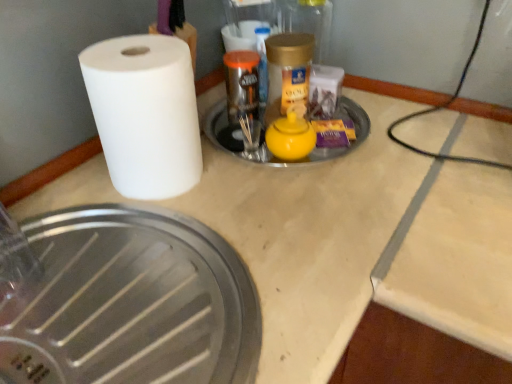
Question: Relative to yellow matte teapot at center, the first manhole cover from the top, is brushed metal manhole cover at lower left, which is counted as the 1th manhole cover, starting from the bottom, in front or behind?

Choices:
 (A) front
 (B) behind

Answer: (A)

Question: Looking at their shapes, would you say brushed metal manhole cover at lower left, the 2th manhole cover viewed from the top, is wider or thinner than yellow matte teapot at center, which appears as the 2th manhole cover when ordered from the bottom?

Choices:
 (A) thin
 (B) wide

Answer: (B)

Question: Estimate the real-world distances between objects in this image. Which object is closer to the yellow matte teapot at center, the first manhole cover from the top?

Choices:
 (A) gold metallic jar at upper center
 (B) brushed metal manhole cover at lower left, which is counted as the 1th manhole cover, starting from the bottom
 (C) white matte paper towel at left

Answer: (C)

Question: Considering the real-world distances, which object is closest to the brushed metal manhole cover at lower left, which is counted as the 1th manhole cover, starting from the bottom?

Choices:
 (A) white matte paper towel at left
 (B) yellow matte teapot at center, which appears as the 2th manhole cover when ordered from the bottom
 (C) gold metallic jar at upper center

Answer: (A)